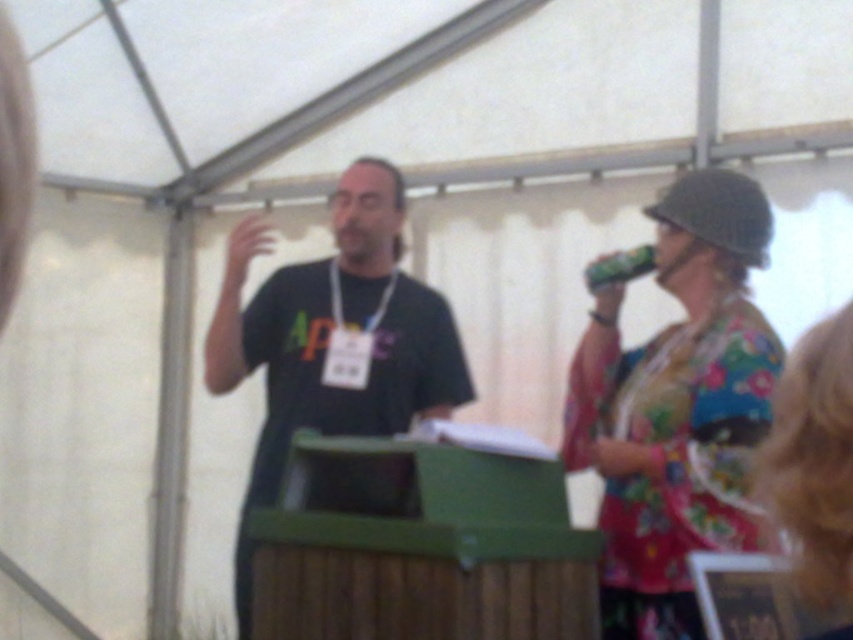
Question: Is floral fabric dress at lower right above green matte can at upper right?

Choices:
 (A) yes
 (B) no

Answer: (B)

Question: Which of the following is the farthest from the observer?

Choices:
 (A) green matte can at upper right
 (B) floral fabric dress at lower right

Answer: (A)

Question: Which object is farther from the camera taking this photo?

Choices:
 (A) floral fabric dress at lower right
 (B) black matte t-shirt at center
 (C) green matte can at upper right

Answer: (B)

Question: Is floral fabric shirt at upper right smaller than black matte t-shirt at center?

Choices:
 (A) yes
 (B) no

Answer: (A)

Question: Is floral fabric shirt at upper right bigger than floral fabric dress at lower right?

Choices:
 (A) no
 (B) yes

Answer: (B)

Question: Which of these objects is positioned farthest from the green matte can at upper right?

Choices:
 (A) black matte t-shirt at center
 (B) floral fabric dress at lower right
 (C) floral fabric shirt at upper right

Answer: (B)